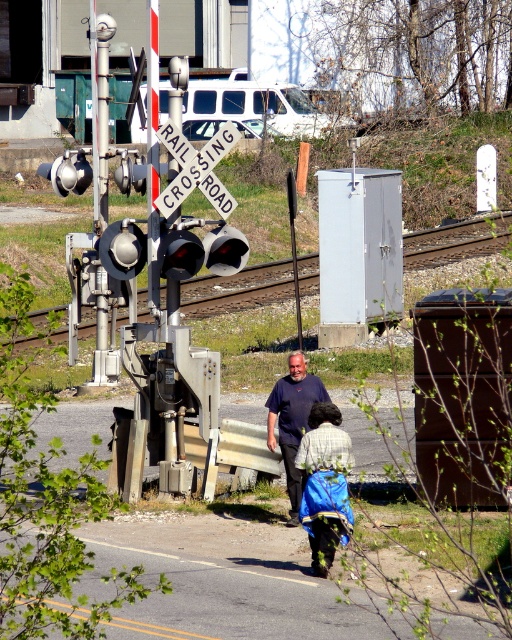
Question: Which point appears farthest from the camera in this image?

Choices:
 (A) (479, 221)
 (B) (327, 470)
 (C) (177, 144)

Answer: (A)

Question: Observing the image, what is the correct spatial positioning of dark blue t-shirt at center in reference to white wooden railroad crossing sign at center?

Choices:
 (A) below
 (B) above

Answer: (A)

Question: Is blue fabric baby carriage at center positioned in front of dark blue t-shirt at center?

Choices:
 (A) no
 (B) yes

Answer: (B)

Question: Considering the real-world distances, which object is farthest from the metal train track at left?

Choices:
 (A) blue fabric baby carriage at center
 (B) white wooden railroad crossing sign at center

Answer: (B)

Question: Can you confirm if dark blue t-shirt at center is positioned to the right of white wooden railroad crossing sign at center?

Choices:
 (A) yes
 (B) no

Answer: (A)

Question: Which of the following is the closest to the observer?

Choices:
 (A) metal train track at left
 (B) dark blue t-shirt at center
 (C) blue fabric baby carriage at center

Answer: (C)